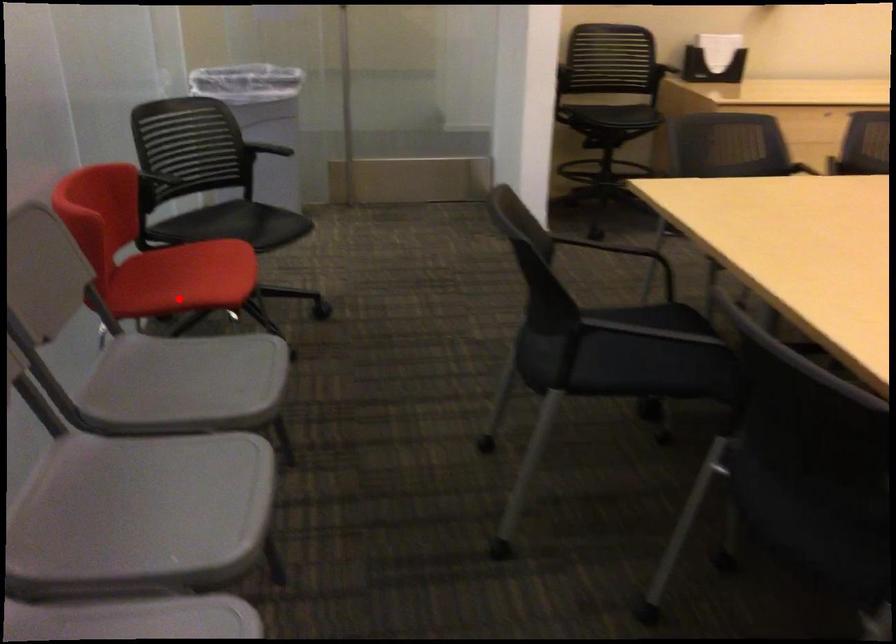
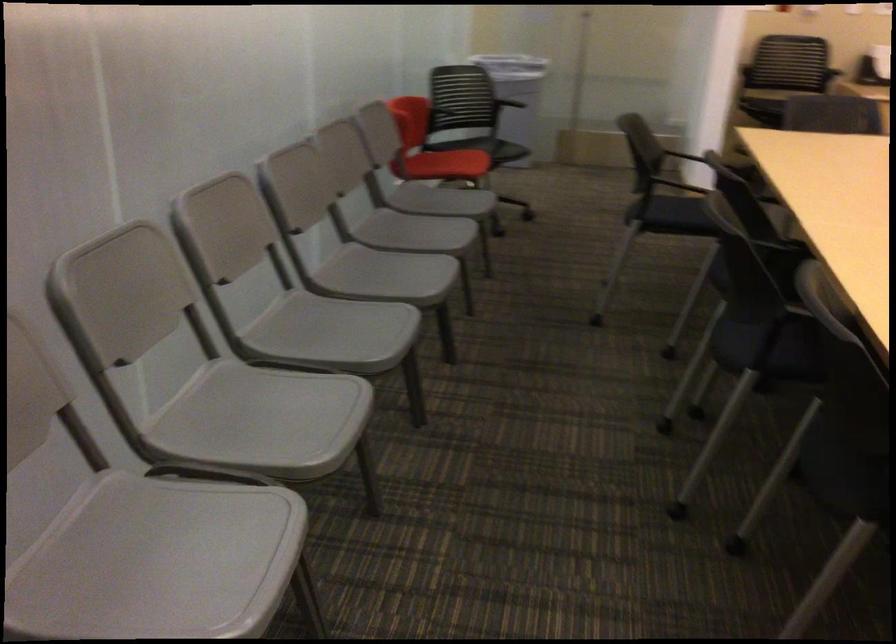
In the second image, find the point that corresponds to the highlighted location in the first image.

(446, 164)